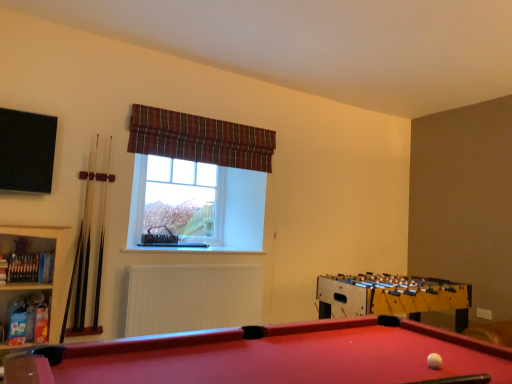
Locate an element on the screen. The height and width of the screenshot is (384, 512). vacant space underneath plaid fabric curtain at upper center (from a real-world perspective) is located at coordinates (205, 259).